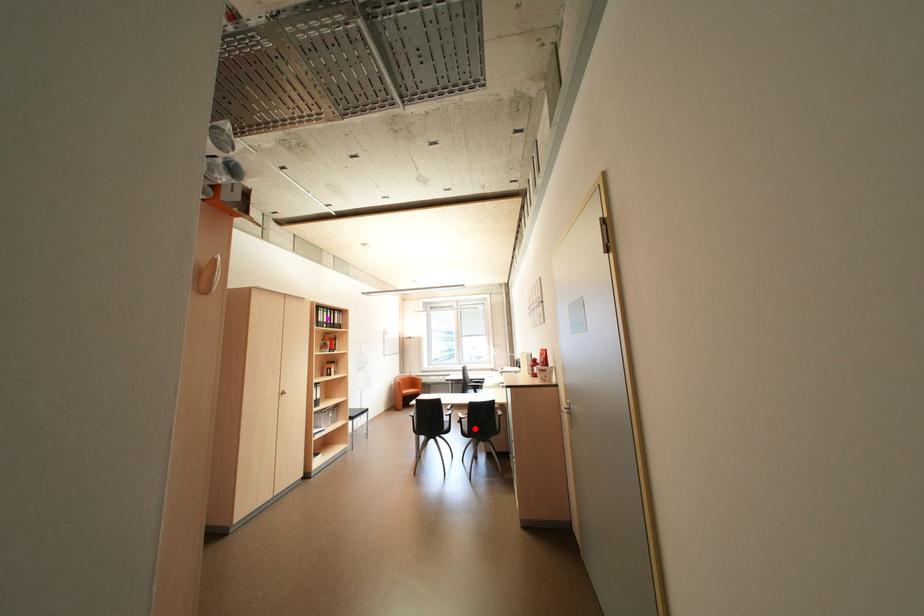
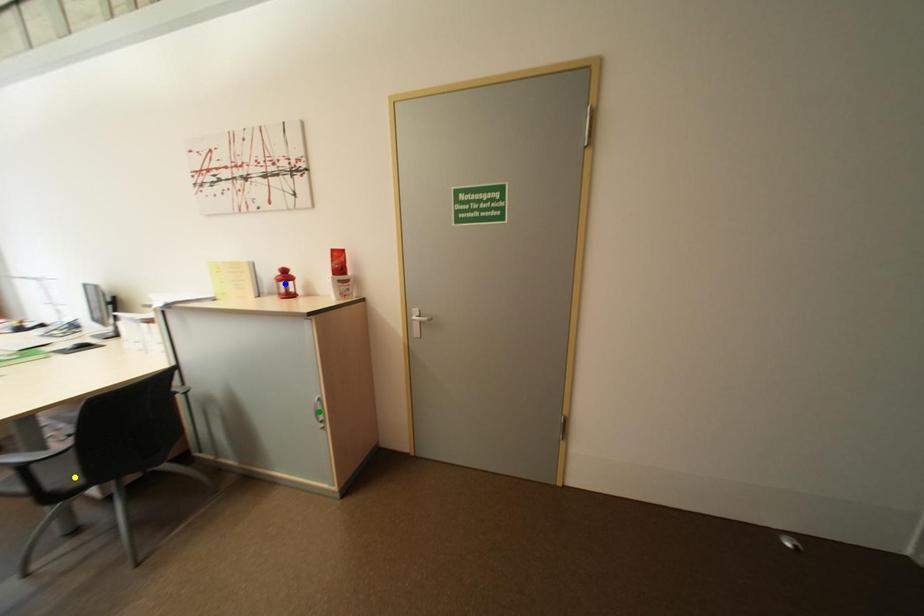
Question: I am providing you with two images of the same scene from different viewpoints. A red point is marked on the first image. You are given multiple points on the second image. Which mark in image 2 goes with the point in image 1?

Choices:
 (A) green point
 (B) yellow point
 (C) blue point

Answer: (B)